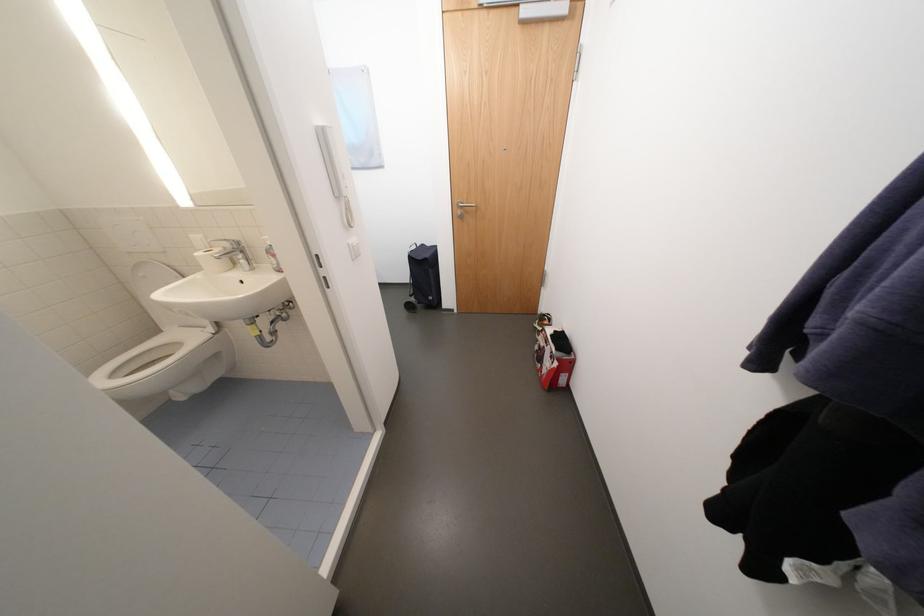
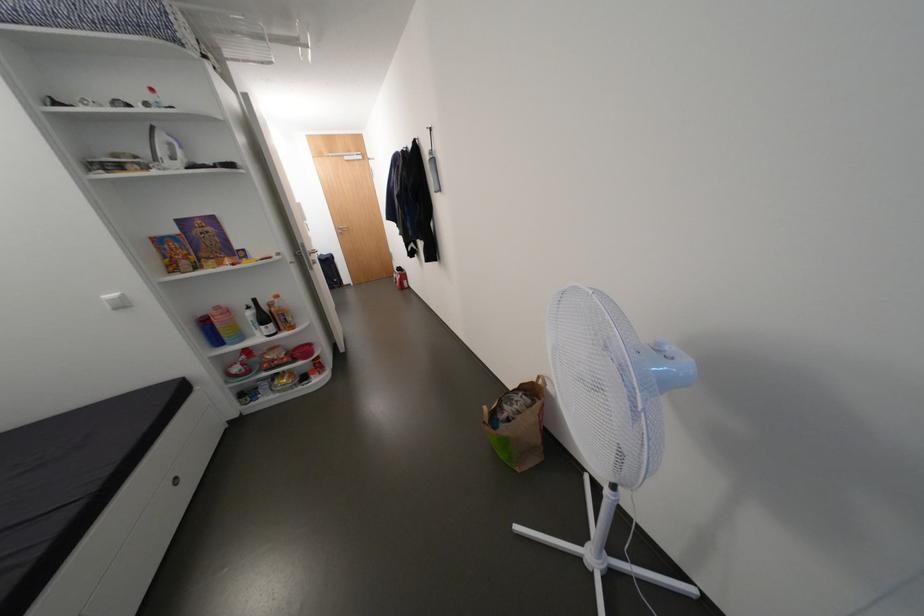
Where in the second image is the point corresponding to point 560,336 from the first image?

(405, 270)